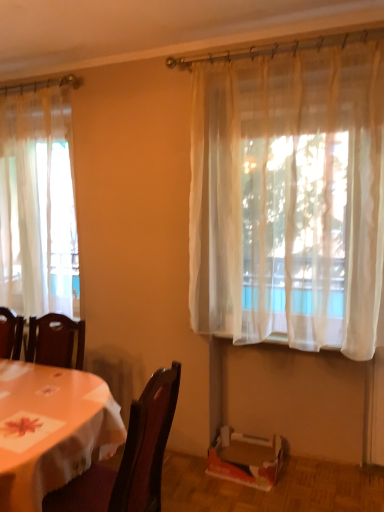
Identify the location of vacant space situated on the left part of cardboard box at lower right. This screenshot has height=512, width=384. (192, 483).